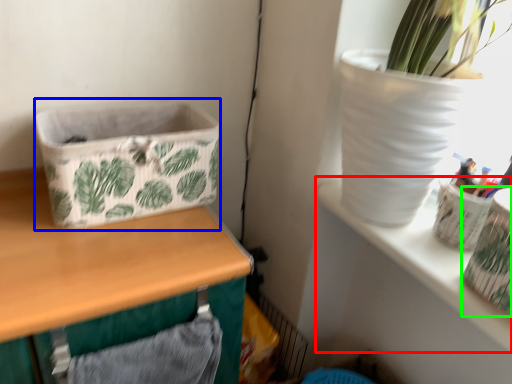
Question: Which object is positioned closest to shelf (highlighted by a red box)? Select from basket container (highlighted by a blue box) and vase (highlighted by a green box).

Choices:
 (A) basket container
 (B) vase

Answer: (B)